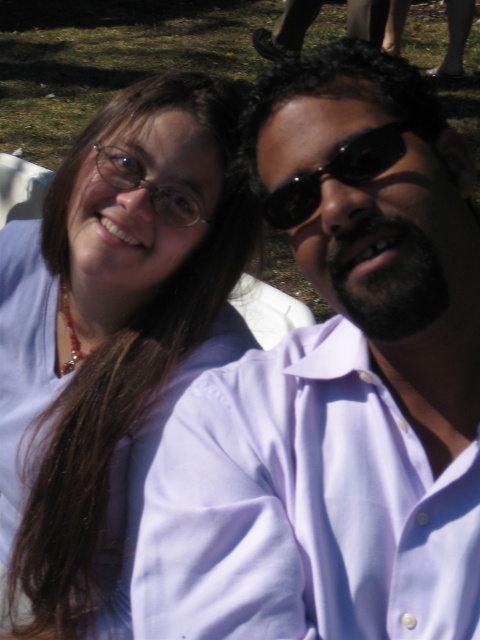
Does matte white shirt at upper right appear under black matte sunglasses at upper right?

Yes, matte white shirt at upper right is below black matte sunglasses at upper right.

Between matte white shirt at upper right and black matte sunglasses at upper right, which one is positioned higher?

Positioned higher is black matte sunglasses at upper right.

What do you see at coordinates (334, 388) in the screenshot?
I see `matte white shirt at upper right` at bounding box center [334, 388].

Find the location of a particular element. matte white shirt at upper right is located at coordinates (334, 388).

Between matte white shirt at left and black matte sunglasses at upper right, which one is positioned higher?

black matte sunglasses at upper right is higher up.

In the scene shown: Does matte white shirt at left appear under black matte sunglasses at upper right?

Yes, matte white shirt at left is below black matte sunglasses at upper right.

This screenshot has width=480, height=640. What do you see at coordinates (109, 332) in the screenshot? I see `matte white shirt at left` at bounding box center [109, 332].

Locate an element on the screen. This screenshot has width=480, height=640. matte white shirt at left is located at coordinates (109, 332).

The height and width of the screenshot is (640, 480). Describe the element at coordinates (334, 388) in the screenshot. I see `matte white shirt at upper right` at that location.

Does matte white shirt at upper right appear under matte white shirt at left?

No, matte white shirt at upper right is not below matte white shirt at left.

Locate an element on the screen. matte white shirt at upper right is located at coordinates (334, 388).

This screenshot has height=640, width=480. What are the coordinates of `matte white shirt at upper right` in the screenshot? It's located at (334, 388).